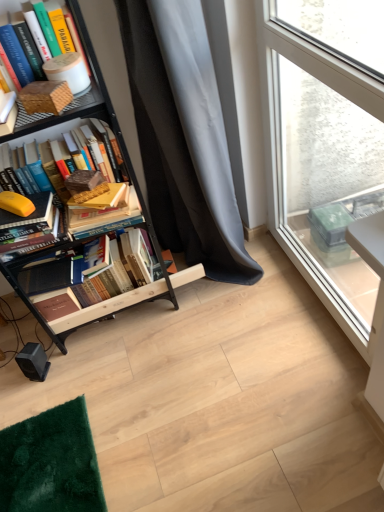
Question: Is the depth of black metal bookcase at left less than that of brown matte paper at left?

Choices:
 (A) no
 (B) yes

Answer: (B)

Question: Is black metal bookcase at left facing away from brown matte paper at left?

Choices:
 (A) yes
 (B) no

Answer: (A)

Question: From a real-world perspective, is black metal bookcase at left on brown matte paper at left?

Choices:
 (A) no
 (B) yes

Answer: (A)

Question: Is black metal bookcase at left taller than brown matte paper at left?

Choices:
 (A) no
 (B) yes

Answer: (B)

Question: Is black metal bookcase at left not near brown matte paper at left?

Choices:
 (A) yes
 (B) no

Answer: (B)

Question: Does black metal bookcase at left have a lesser width compared to brown matte paper at left?

Choices:
 (A) no
 (B) yes

Answer: (A)

Question: Is hardcover book at left, marked as the 4th book in a bottom-to-top arrangement, not close to brown matte paper at left?

Choices:
 (A) no
 (B) yes

Answer: (A)

Question: Does hardcover book at left, the second book positioned from the top, have a greater height compared to brown matte paper at left?

Choices:
 (A) no
 (B) yes

Answer: (B)

Question: From the image's perspective, is hardcover book at left, marked as the 4th book in a bottom-to-top arrangement, beneath brown matte paper at left?

Choices:
 (A) no
 (B) yes

Answer: (B)

Question: From a real-world perspective, does hardcover book at left, marked as the 4th book in a bottom-to-top arrangement, stand above brown matte paper at left?

Choices:
 (A) yes
 (B) no

Answer: (B)

Question: Is hardcover book at left, marked as the 4th book in a bottom-to-top arrangement, behind brown matte paper at left?

Choices:
 (A) no
 (B) yes

Answer: (B)

Question: Can you confirm if hardcover book at left, the second book positioned from the top, is bigger than brown matte paper at left?

Choices:
 (A) yes
 (B) no

Answer: (A)

Question: Considering the relative positions of gray fabric curtain at center and hardcover books at left, the first book ordered from the bottom, in the image provided, is gray fabric curtain at center to the right of hardcover books at left, the first book ordered from the bottom, from the viewer's perspective?

Choices:
 (A) yes
 (B) no

Answer: (A)